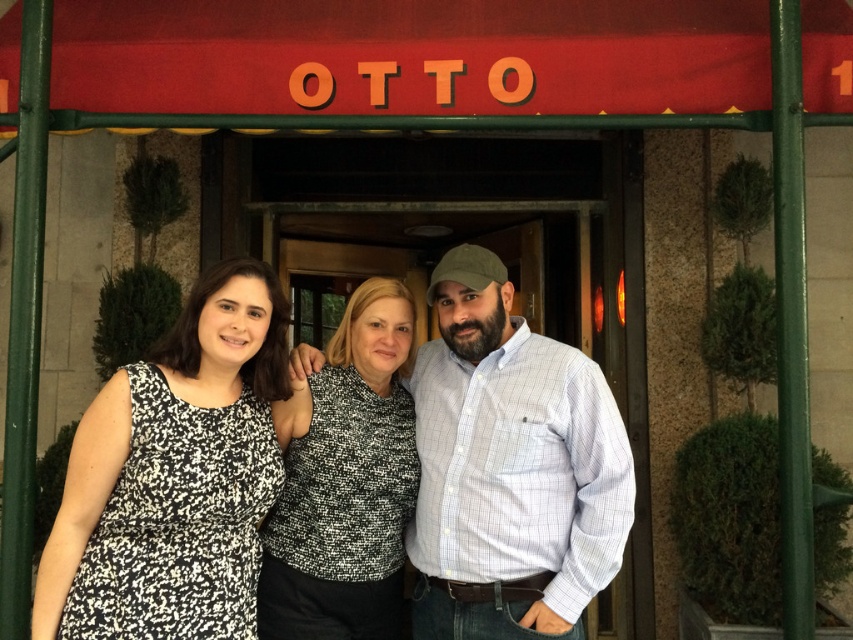
Question: Based on their relative distances, which object is nearer to the printed fabric shirt at center?

Choices:
 (A) white checkered shirt at center
 (B) black printed dress at left

Answer: (A)

Question: Can you confirm if white checkered shirt at center is positioned to the right of speckled fabric blouse at center?

Choices:
 (A) no
 (B) yes

Answer: (B)

Question: Which is nearer to the black printed dress at left?

Choices:
 (A) white checkered shirt at center
 (B) speckled fabric blouse at center

Answer: (B)

Question: Can you confirm if white checkered shirt at center is thinner than printed fabric shirt at center?

Choices:
 (A) no
 (B) yes

Answer: (B)

Question: Which point is closer to the camera?

Choices:
 (A) white checkered shirt at center
 (B) black printed dress at left
 (C) printed fabric shirt at center
 (D) speckled fabric blouse at center

Answer: (B)

Question: Can you confirm if black printed dress at left is smaller than speckled fabric blouse at center?

Choices:
 (A) yes
 (B) no

Answer: (B)